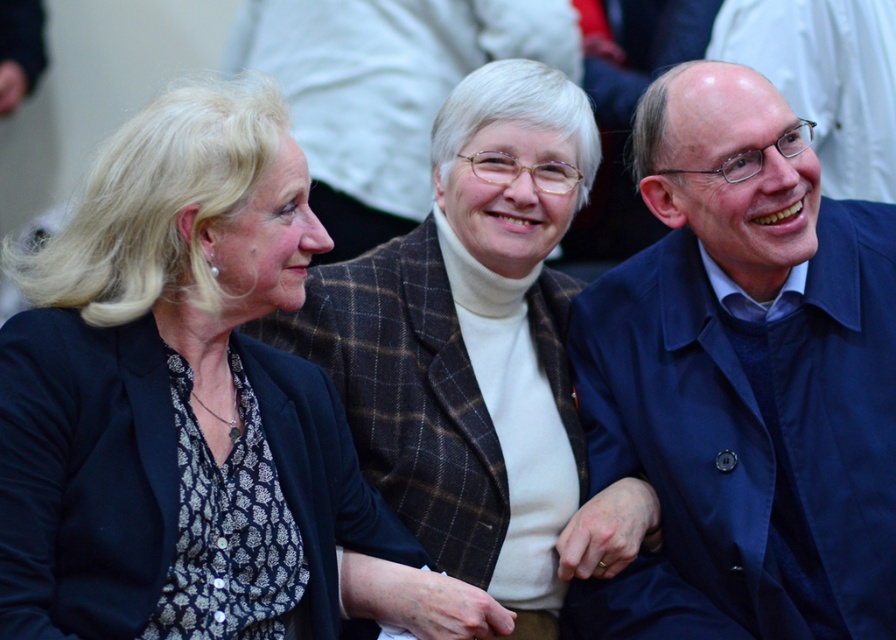
Question: Which object is the closest to the blue fabric coat at right?

Choices:
 (A) matte black blazer at center
 (B) patterned fabric jacket at center

Answer: (B)

Question: Is blue fabric coat at right further to camera compared to patterned fabric jacket at center?

Choices:
 (A) yes
 (B) no

Answer: (A)

Question: Which of these objects is positioned closest to the matte black blazer at center?

Choices:
 (A) patterned fabric jacket at center
 (B) blue fabric coat at right

Answer: (A)

Question: Which of the following is the closest to the observer?

Choices:
 (A) patterned fabric jacket at center
 (B) matte black blazer at center

Answer: (B)

Question: Where is patterned fabric jacket at center located in relation to matte black blazer at center in the image?

Choices:
 (A) left
 (B) right

Answer: (B)

Question: Is patterned fabric jacket at center to the right of matte black blazer at center from the viewer's perspective?

Choices:
 (A) yes
 (B) no

Answer: (A)